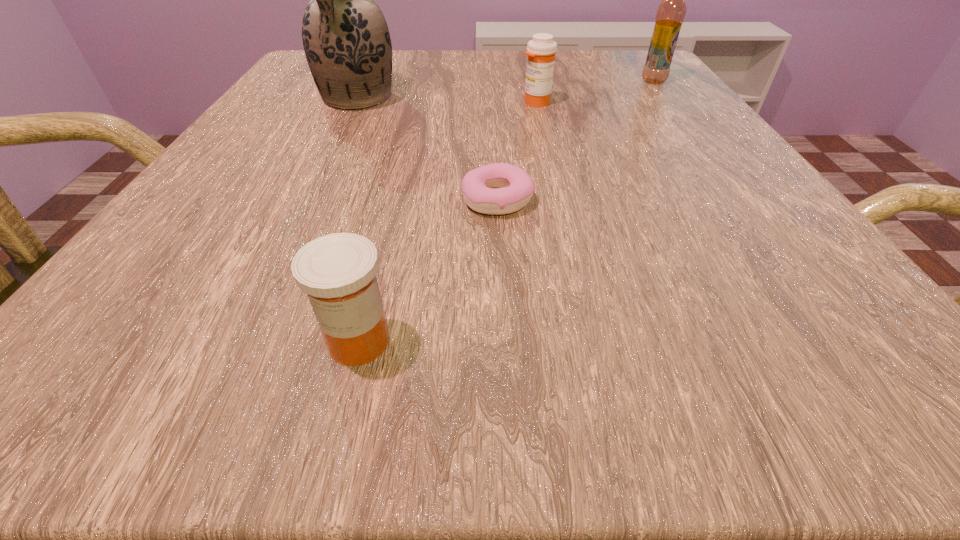
Image resolution: width=960 pixels, height=540 pixels. Identify the location of vase. (346, 40).

Identify the location of the leftmost object. The image size is (960, 540). (346, 40).

Identify the location of bottle. (671, 12).

Identify the location of the rightmost object. coord(671,12).

You are a GUI agent. You are given a task and a screenshot of the screen. Output one action in this format:
    pyautogui.click(x=<x>, y=<y>)
    Task: Click on the right medicine
    
    Given the screenshot: What is the action you would take?
    pyautogui.click(x=541, y=51)

Locate an element on the screen. the second object from right to left is located at coordinates (541, 51).

What are the coordinates of `the second object from left to right` in the screenshot? It's located at (338, 271).

Image resolution: width=960 pixels, height=540 pixels. I want to click on the left medicine, so click(338, 271).

In order to click on the third object from right to left in this screenshot , I will do `click(514, 187)`.

Image resolution: width=960 pixels, height=540 pixels. I want to click on pastry, so click(x=514, y=187).